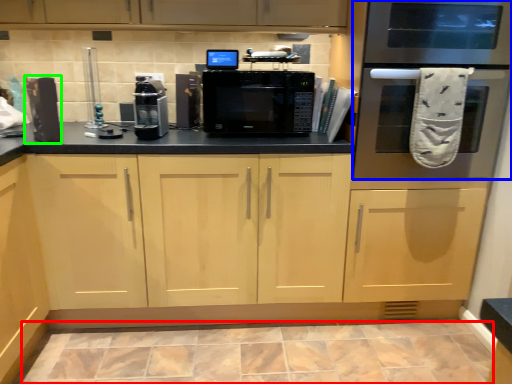
Question: Which is nearer to the ceramic tile (highlighted by a red box)? oven (highlighted by a blue box) or appliance (highlighted by a green box).

Choices:
 (A) oven
 (B) appliance

Answer: (A)